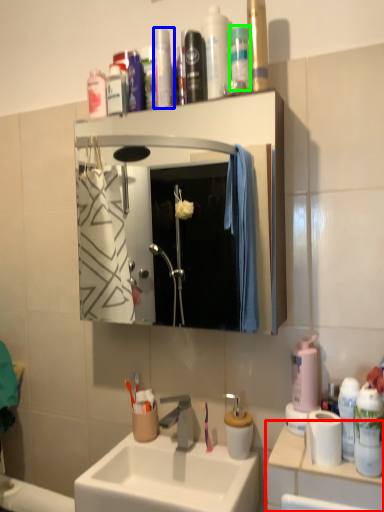
Question: Considering the real-world distances, which object is farthest from counter top (highlighted by a red box)? toiletry (highlighted by a blue box) or mouthwash (highlighted by a green box)?

Choices:
 (A) toiletry
 (B) mouthwash

Answer: (A)